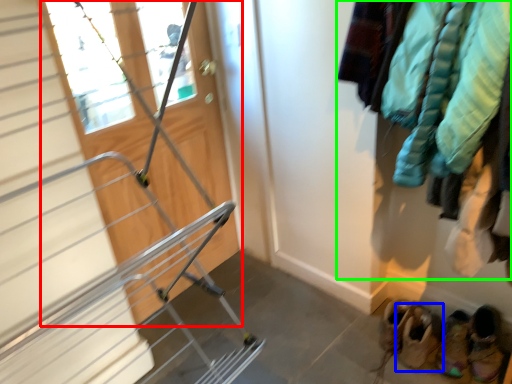
Question: Which object is the farthest from door (highlighted by a red box)? Choose among these: footwear (highlighted by a blue box) or clothing (highlighted by a green box).

Choices:
 (A) footwear
 (B) clothing

Answer: (A)